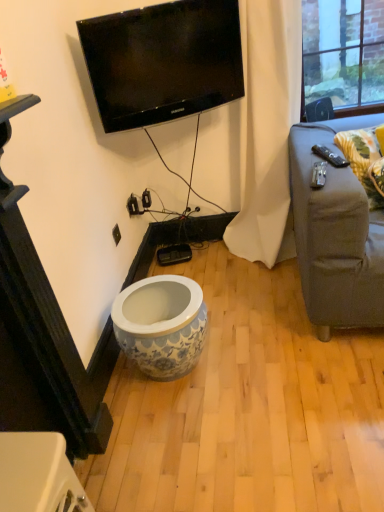
In order to click on blue and white ceramic vase at center in this screenshot , I will do `click(161, 324)`.

Describe the element at coordinates (161, 324) in the screenshot. I see `blue and white ceramic vase at center` at that location.

The width and height of the screenshot is (384, 512). Find the location of `white fabric curtain at center`. white fabric curtain at center is located at coordinates (268, 131).

Considering the points (130, 85) and (370, 163), which point is in front, point (130, 85) or point (370, 163)?

Positioned in front is point (370, 163).

Is black glossy tv at upper center facing towards yellow floral fabric pillow at right?

No.

From the image's perspective, is black glossy tv at upper center above or below yellow floral fabric pillow at right?

Based on their image positions, black glossy tv at upper center is located above yellow floral fabric pillow at right.

Which of these two, black glossy tv at upper center or yellow floral fabric pillow at right, is wider?

With larger width is yellow floral fabric pillow at right.

In terms of width, does white fabric curtain at center look wider or thinner when compared to blue and white ceramic vase at center?

In the image, white fabric curtain at center appears to be wider than blue and white ceramic vase at center.

Between white fabric curtain at center and blue and white ceramic vase at center, which one has less height?

Standing shorter between the two is blue and white ceramic vase at center.

Who is bigger, white fabric curtain at center or blue and white ceramic vase at center?

white fabric curtain at center.

From the image's perspective, would you say white fabric curtain at center is positioned over blue and white ceramic vase at center?

Correct, white fabric curtain at center appears higher than blue and white ceramic vase at center in the image.

Considering the sizes of objects blue and white ceramic vase at center and black glossy tv at upper center in the image provided, who is thinner, blue and white ceramic vase at center or black glossy tv at upper center?

black glossy tv at upper center is thinner.

Is blue and white ceramic vase at center at the left side of black glossy tv at upper center?

Correct, you'll find blue and white ceramic vase at center to the left of black glossy tv at upper center.

From a real-world perspective, is blue and white ceramic vase at center positioned above or below black glossy tv at upper center?

In terms of real-world spatial position, blue and white ceramic vase at center is below black glossy tv at upper center.

From the image's perspective, is blue and white ceramic vase at center under black glossy tv at upper center?

Yes.

Between black glossy tv at upper center and blue and white ceramic vase at center, which one has smaller width?

With smaller width is black glossy tv at upper center.

From the image's perspective, which one is positioned lower, black glossy tv at upper center or blue and white ceramic vase at center?

blue and white ceramic vase at center, from the image's perspective.

From a real-world perspective, between black glossy tv at upper center and blue and white ceramic vase at center, who is vertically higher?

In real-world perspective, black glossy tv at upper center is above.

Is blue and white ceramic vase at center at the back of black glossy tv at upper center?

That's not correct — black glossy tv at upper center is not looking away from blue and white ceramic vase at center.

Based on the photo, would you say yellow floral fabric pillow at right is outside blue and white ceramic vase at center?

That's correct, yellow floral fabric pillow at right is outside of blue and white ceramic vase at center.

Does yellow floral fabric pillow at right have a lesser width compared to blue and white ceramic vase at center?

Yes.

From the image's perspective, which is below, yellow floral fabric pillow at right or blue and white ceramic vase at center?

blue and white ceramic vase at center is shown below in the image.

Is yellow floral fabric pillow at right positioned beyond the bounds of black glossy tv at upper center?

Yes.

Which is more to the right, yellow floral fabric pillow at right or black glossy tv at upper center?

Positioned to the right is yellow floral fabric pillow at right.

In the scene shown: Would you consider yellow floral fabric pillow at right to be distant from black glossy tv at upper center?

They are positioned close to each other.

Where is `television to the left of yellow floral fabric pillow at right`? television to the left of yellow floral fabric pillow at right is located at coordinates (163, 61).

Choose the correct answer: Is blue and white ceramic vase at center inside white fabric curtain at center or outside it?

The correct answer is: outside.

Which of these two, blue and white ceramic vase at center or white fabric curtain at center, stands shorter?

blue and white ceramic vase at center is shorter.

In the image, is blue and white ceramic vase at center positioned in front of or behind white fabric curtain at center?

blue and white ceramic vase at center is positioned closer to the viewer than white fabric curtain at center.

Is blue and white ceramic vase at center to the right of white fabric curtain at center from the viewer's perspective?

No.

Find the location of a particular element. The image size is (384, 512). television to the left of yellow floral fabric pillow at right is located at coordinates (163, 61).

Find the location of a particular element. The image size is (384, 512). curtain behind the blue and white ceramic vase at center is located at coordinates (268, 131).

Looking at the image, which one is located closer to black glossy tv at upper center, white fabric curtain at center or blue and white ceramic vase at center?

Among the two, white fabric curtain at center is located nearer to black glossy tv at upper center.

Estimate the real-world distances between objects in this image. Which object is closer to blue and white ceramic vase at center, yellow floral fabric pillow at right or white fabric curtain at center?

white fabric curtain at center.

When comparing their distances from white fabric curtain at center, does black glossy tv at upper center or yellow floral fabric pillow at right seem closer?

black glossy tv at upper center is closer to white fabric curtain at center.

When comparing their distances from yellow floral fabric pillow at right, does white fabric curtain at center or blue and white ceramic vase at center seem further?

blue and white ceramic vase at center lies further to yellow floral fabric pillow at right than the other object.

From the image, which object appears to be farther from white fabric curtain at center, black glossy tv at upper center or blue and white ceramic vase at center?

Result: blue and white ceramic vase at center is further to white fabric curtain at center.

Which object lies further to the anchor point black glossy tv at upper center, yellow floral fabric pillow at right or blue and white ceramic vase at center?

Based on the image, blue and white ceramic vase at center appears to be further to black glossy tv at upper center.

Based on their spatial positions, is white fabric curtain at center or yellow floral fabric pillow at right further from black glossy tv at upper center?

yellow floral fabric pillow at right.

From the image, which object appears to be farther from white fabric curtain at center, blue and white ceramic vase at center or black glossy tv at upper center?

blue and white ceramic vase at center is further to white fabric curtain at center.

This screenshot has height=512, width=384. I want to click on pillow between white fabric curtain at center and blue and white ceramic vase at center from top to bottom, so click(x=363, y=160).

The height and width of the screenshot is (512, 384). Identify the location of pillow between black glossy tv at upper center and blue and white ceramic vase at center in the up-down direction. (363, 160).

This screenshot has height=512, width=384. I want to click on curtain between black glossy tv at upper center and blue and white ceramic vase at center vertically, so click(268, 131).

Where is `curtain between black glossy tv at upper center and yellow floral fabric pillow at right in the horizontal direction`? This screenshot has width=384, height=512. curtain between black glossy tv at upper center and yellow floral fabric pillow at right in the horizontal direction is located at coordinates point(268,131).